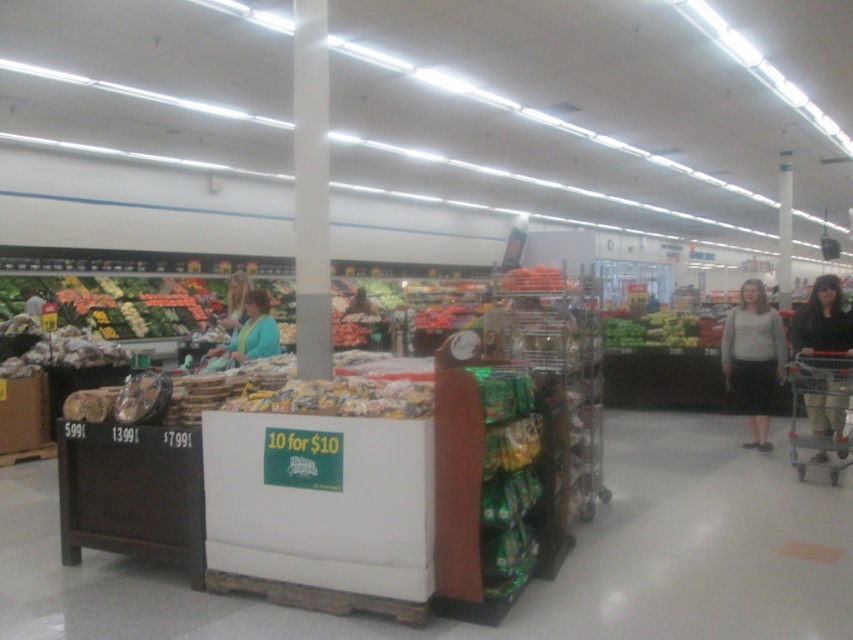
You are a customer in the grocery store and want to walk from the snack display to the entrance. There is a metallic silver shopping cart at lower right and a teal fabric jacket at center in your path. Which object might block your path more due to its width?

The metallic silver shopping cart at lower right might block the path more than the teal fabric jacket at center because it is wider according to the description.